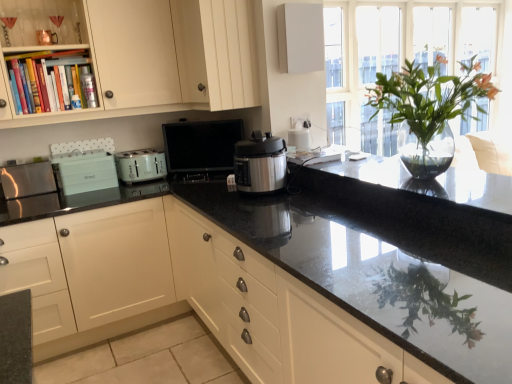
Locate an element on the screen. The width and height of the screenshot is (512, 384). free spot in front of stainless steel pressure cooker at center is located at coordinates (271, 208).